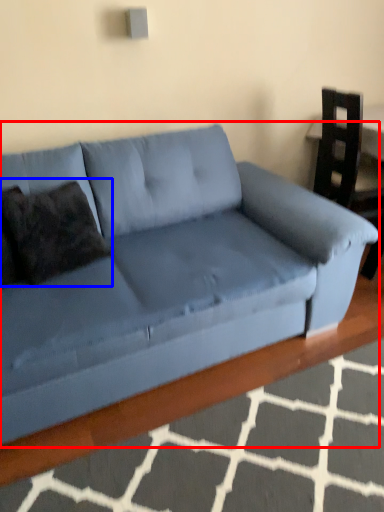
Question: Which object is further to the camera taking this photo, studio couch (highlighted by a red box) or pillow (highlighted by a blue box)?

Choices:
 (A) studio couch
 (B) pillow

Answer: (B)